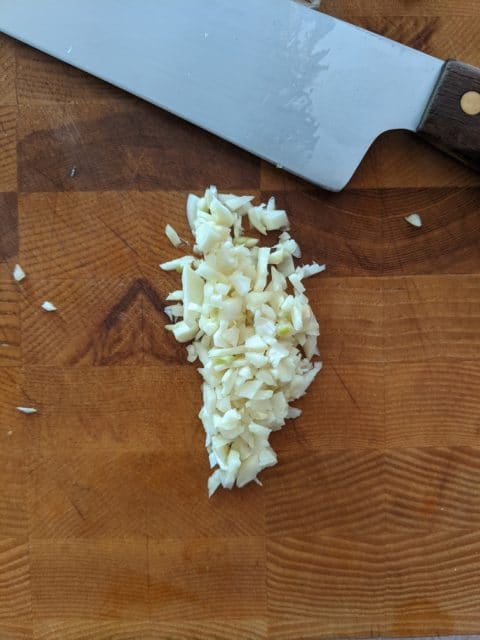
The image size is (480, 640). In order to click on dark brown wood in this screenshot , I will do `click(441, 118)`.